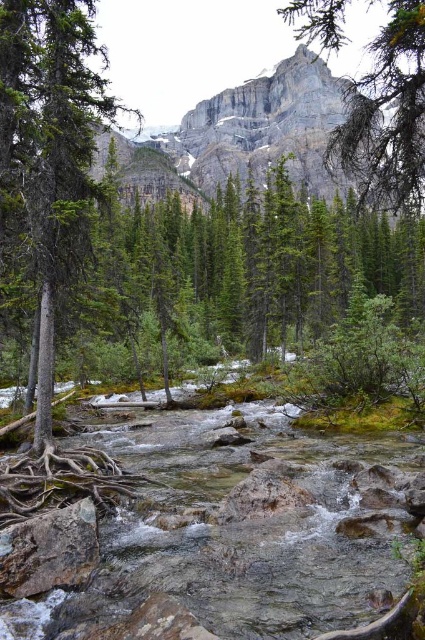
Question: Is rocky cliff at upper center bigger than gray rough rock at center?

Choices:
 (A) no
 (B) yes

Answer: (B)

Question: Does rocky cliff at upper center have a greater width compared to brown rough tree roots at lower left?

Choices:
 (A) yes
 (B) no

Answer: (A)

Question: Which object appears farthest from the camera in this image?

Choices:
 (A) green matte tree at left
 (B) rocky cliff at upper center

Answer: (B)

Question: Is rocky cliff at upper center below brown rough tree roots at lower left?

Choices:
 (A) no
 (B) yes

Answer: (A)

Question: Which of the following is the closest to the observer?

Choices:
 (A) brown rough tree roots at lower left
 (B) gray rough rock at center

Answer: (B)

Question: Which of the following is the closest to the observer?

Choices:
 (A) green matte tree at left
 (B) brown rough tree roots at lower left

Answer: (B)